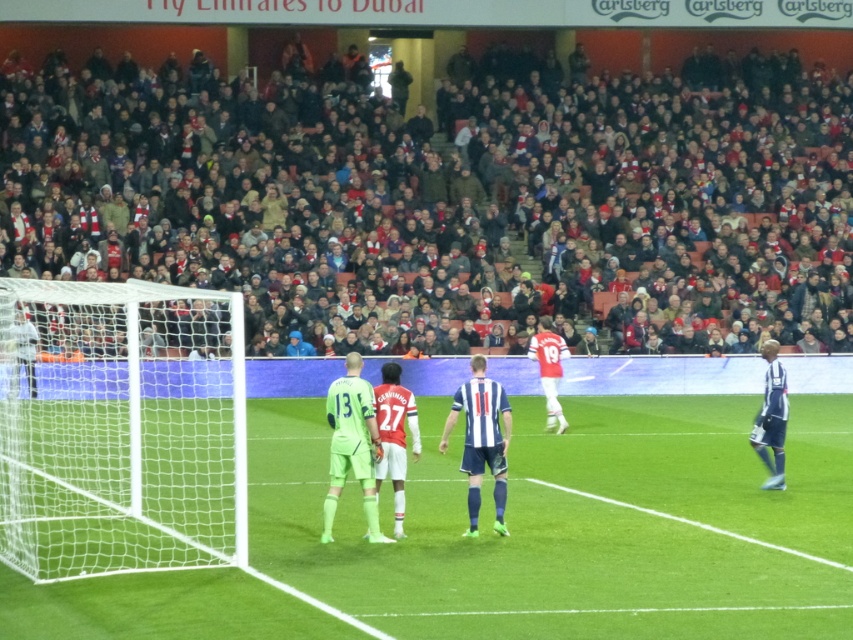
You are a photographer standing at the edge of the soccer field. You want to take a photo that includes both the dark brown leather seats at upper center and the blue jersey at right. Based on their positions, which object should you adjust your camera to focus on first to ensure both are in frame?

The dark brown leather seats at upper center is positioned on the left side of blue jersey at right. Therefore, you should focus on the dark brown leather seats at upper center first since it is closer to your current position at the edge of the field, ensuring both objects remain in frame.

You are a spectator sitting in the dark brown leather seats at upper center and want to watch the neon green jersey at center. In which direction should you turn your head to see the player?

The dark brown leather seats at upper center is to the right of the neon green jersey at center, so you should turn your head to the left to see the player.

You are a soccer referee positioned at the corner flag post on the left side of the field. You need to determine the position of two points marked on the field for a penalty kick. According to the image, which point is closer to you, point at coordinates (309,221) or point at coordinates (352,388)?

Point at coordinates (309,221) is behind point at coordinates (352,388), so the closer point to you is point at coordinates (352,388).